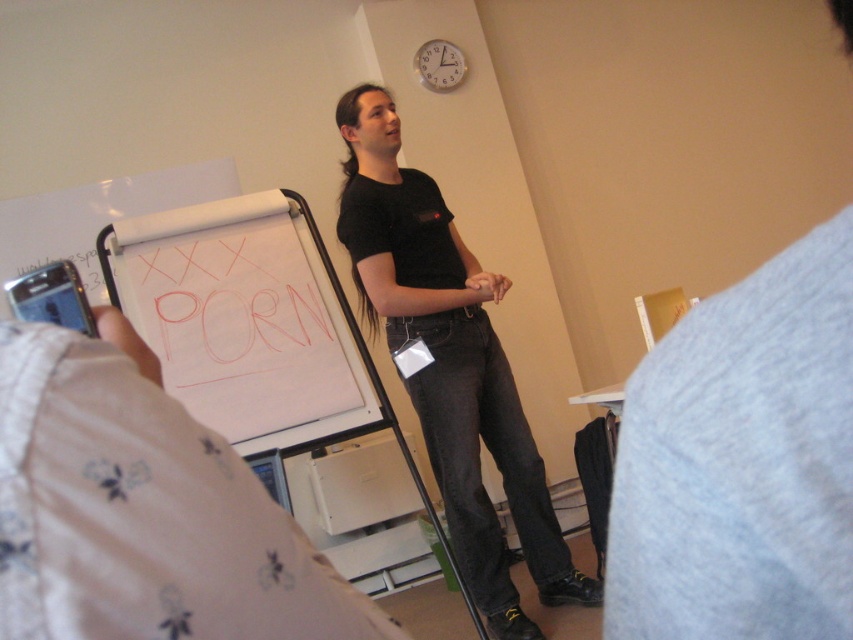
Question: Is black matte shirt at center positioned at the back of white paperboard at center?

Choices:
 (A) no
 (B) yes

Answer: (B)

Question: Which of the following is the closest to the observer?

Choices:
 (A) black matte shirt at center
 (B) white paperboard at center

Answer: (B)

Question: Does black matte shirt at center appear on the left side of white paperboard at center?

Choices:
 (A) yes
 (B) no

Answer: (B)

Question: Which of the following is the farthest from the observer?

Choices:
 (A) (514, 499)
 (B) (264, 330)

Answer: (A)

Question: Which object is farther from the camera taking this photo?

Choices:
 (A) white paperboard at center
 (B) black matte shirt at center

Answer: (B)

Question: Can you confirm if black matte shirt at center is positioned above white paperboard at center?

Choices:
 (A) no
 (B) yes

Answer: (A)